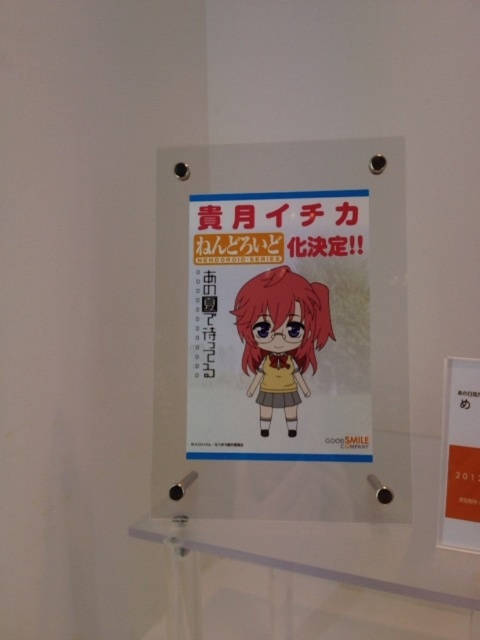
Is point (332, 298) behind point (250, 300)?

No, it is in front of (250, 300).

From the picture: Does matte paper poster at center have a larger size compared to matte yellow uniform at center?

Correct, matte paper poster at center is larger in size than matte yellow uniform at center.

The image size is (480, 640). I want to click on matte paper poster at center, so click(278, 326).

Image resolution: width=480 pixels, height=640 pixels. Identify the location of matte paper poster at center. (278, 326).